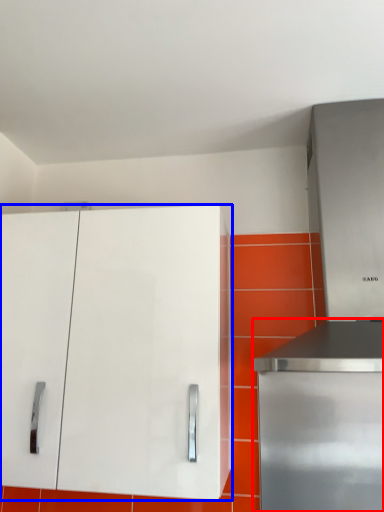
Question: Among these objects, which one is nearest to the camera, home appliance (highlighted by a red box) or cabinetry (highlighted by a blue box)?

Choices:
 (A) home appliance
 (B) cabinetry

Answer: (B)